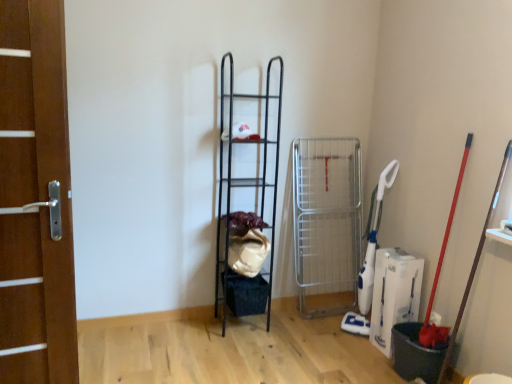
Locate an element on the screen. The image size is (512, 384). free space to the left of black metal shelf at center is located at coordinates (192, 331).